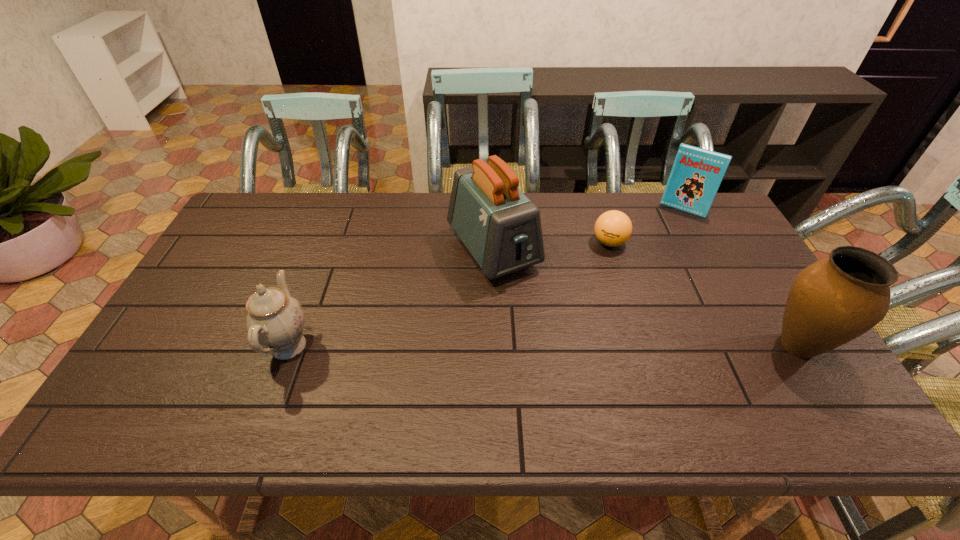
Identify the location of free location at the left edge. The height and width of the screenshot is (540, 960). (217, 301).

Locate an element on the screen. The image size is (960, 540). free location at the right edge is located at coordinates (704, 245).

The image size is (960, 540). In the image, there is a desktop. What are the coordinates of `blank space at the far left corner` in the screenshot? It's located at coord(255,193).

Find the location of a particular element. The height and width of the screenshot is (540, 960). blank area at the near left corner is located at coordinates (147, 383).

Where is `vacant space at the far right corner of the desktop`? Image resolution: width=960 pixels, height=540 pixels. vacant space at the far right corner of the desktop is located at coordinates (697, 232).

Find the location of `vacant space in between the ping-pong ball and the second object from left to right`. vacant space in between the ping-pong ball and the second object from left to right is located at coordinates (551, 246).

Find the location of a particular element. free point between the book and the urn is located at coordinates (741, 277).

Locate an element on the screen. The height and width of the screenshot is (540, 960). free spot between the shortest object and the urn is located at coordinates (704, 294).

Identify the location of free space between the urn and the book. (741, 277).

The image size is (960, 540). What are the coordinates of `vacant area between the urn and the book` in the screenshot? It's located at (741, 277).